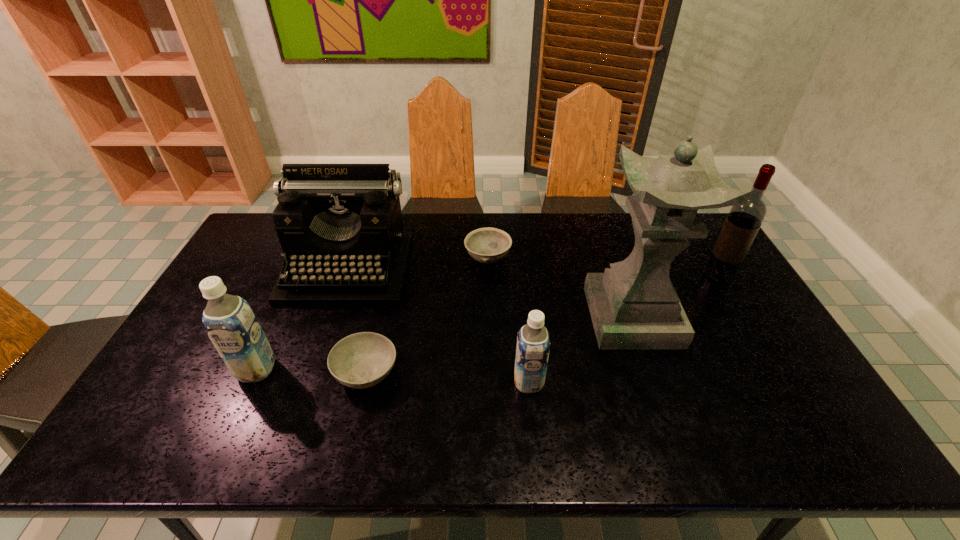
The width and height of the screenshot is (960, 540). In order to click on empty location between the farther bowl and the taller soya milk in this screenshot , I will do `click(372, 314)`.

The width and height of the screenshot is (960, 540). I want to click on blank region between the left bowl and the typewriter, so click(x=357, y=320).

Find the location of `vacant space in between the typewriter and the second object from right to left`. vacant space in between the typewriter and the second object from right to left is located at coordinates (490, 293).

Locate an element on the screen. empty space between the farther bowl and the second object from right to left is located at coordinates (560, 288).

This screenshot has height=540, width=960. What are the coordinates of `free area in between the rightmost object and the taller soya milk` in the screenshot? It's located at [488, 322].

Where is `unoccupied position between the sculpture and the shorter soya milk`? The image size is (960, 540). unoccupied position between the sculpture and the shorter soya milk is located at coordinates (581, 349).

I want to click on free spot between the shorter soya milk and the right bowl, so click(x=508, y=320).

The width and height of the screenshot is (960, 540). I want to click on free point between the tallest object and the right bowl, so click(560, 288).

I want to click on free point between the typewriter and the third shortest object, so click(x=438, y=326).

Locate which object is the fourth closest to the typewriter. Please provide its 2D coordinates. Your answer should be formatted as a tuple, i.e. [(x, y)], where the tuple contains the x and y coordinates of a point satisfying the conditions above.

[(533, 343)]